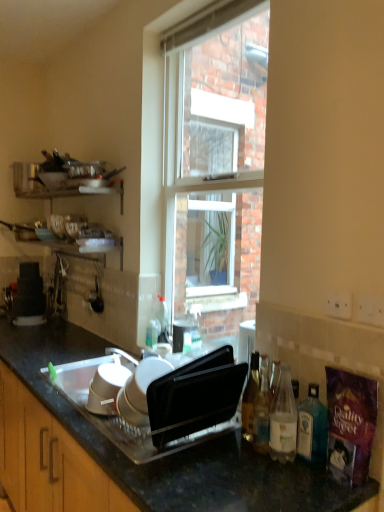
At what (x,y) coordinates should I click in order to perform the action: click on vacant space in front of translucent glass bottle at lower right, which is counted as the 3th bottle, starting from the right. Please return your answer as a coordinate pair (x, y). Looking at the image, I should click on (271, 477).